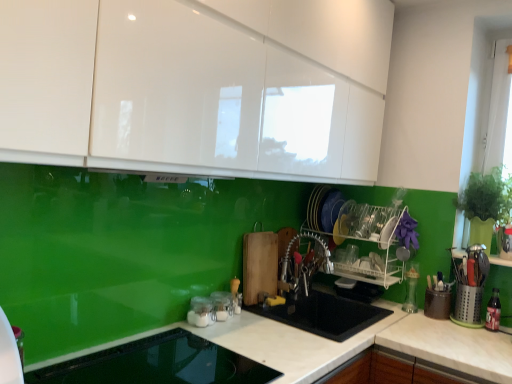
Find the location of a particular element. This screenshot has width=512, height=384. free space in front of clear glass jars at center, the 4th appliance from the back is located at coordinates (216, 334).